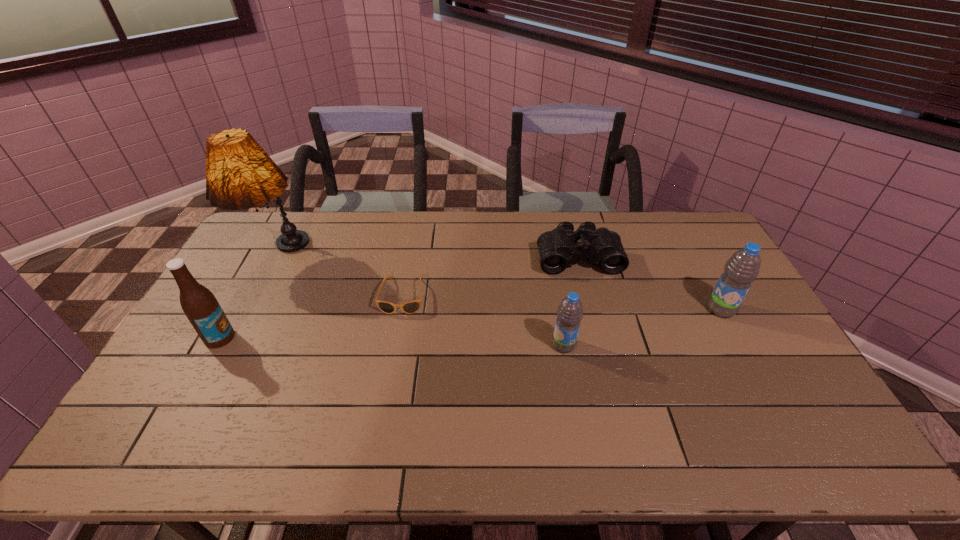
The height and width of the screenshot is (540, 960). In order to click on the fourth tallest object in this screenshot , I will do `click(570, 311)`.

Locate an element on the screen. the nearer water bottle is located at coordinates (570, 311).

I want to click on the right water bottle, so click(742, 268).

Identify the location of the taller water bottle. The height and width of the screenshot is (540, 960). (742, 268).

At what (x,y) coordinates should I click in order to perform the action: click on lampshade. Please return your answer as a coordinate pair (x, y). Looking at the image, I should click on (239, 174).

You are a GUI agent. You are given a task and a screenshot of the screen. Output one action in this format:
    pyautogui.click(x=<x>, y=<y>)
    Task: Click on the fourth object from right to left
    
    Given the screenshot: What is the action you would take?
    pyautogui.click(x=410, y=307)

Where is `the shortest object`? the shortest object is located at coordinates (410, 307).

You are a GUI agent. You are given a task and a screenshot of the screen. Output one action in this format:
    pyautogui.click(x=<x>, y=<y>)
    Task: Click on the beer bottle
    
    Given the screenshot: What is the action you would take?
    pos(202,309)

Locate an element on the screen. The height and width of the screenshot is (540, 960). binoculars is located at coordinates (557, 248).

This screenshot has height=540, width=960. I want to click on free location located 0.150m on the left of the nearer water bottle, so click(x=499, y=345).